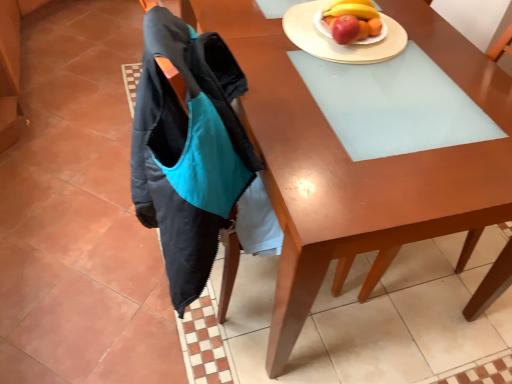
Question: Is wooden plate at upper right, the second plate when ordered from right to left, not within wooden desk at center?

Choices:
 (A) no
 (B) yes

Answer: (A)

Question: Considering the relative sizes of wooden plate at upper right, the second plate when ordered from right to left, and wooden desk at center in the image provided, is wooden plate at upper right, the second plate when ordered from right to left, smaller than wooden desk at center?

Choices:
 (A) yes
 (B) no

Answer: (A)

Question: Is wooden plate at upper right, placed as the 1th plate when sorted from left to right, facing towards wooden desk at center?

Choices:
 (A) yes
 (B) no

Answer: (A)

Question: From the image's perspective, is wooden plate at upper right, placed as the 1th plate when sorted from left to right, beneath wooden desk at center?

Choices:
 (A) no
 (B) yes

Answer: (A)

Question: Is wooden plate at upper right, the second plate when ordered from right to left, taller than wooden desk at center?

Choices:
 (A) no
 (B) yes

Answer: (A)

Question: Is wooden plate at upper right, the second plate when ordered from right to left, positioned in front of wooden desk at center?

Choices:
 (A) no
 (B) yes

Answer: (A)

Question: Does matte wood chair at upper right appear on the right side of wooden desk at center?

Choices:
 (A) yes
 (B) no

Answer: (A)

Question: From the image's perspective, is matte wood chair at upper right on wooden desk at center?

Choices:
 (A) yes
 (B) no

Answer: (B)

Question: Can you confirm if matte wood chair at upper right is taller than wooden desk at center?

Choices:
 (A) yes
 (B) no

Answer: (A)

Question: From a real-world perspective, does matte wood chair at upper right stand above wooden desk at center?

Choices:
 (A) no
 (B) yes

Answer: (B)

Question: Is matte wood chair at upper right oriented towards wooden desk at center?

Choices:
 (A) yes
 (B) no

Answer: (A)

Question: Does matte wood chair at upper right have a lesser height compared to wooden desk at center?

Choices:
 (A) yes
 (B) no

Answer: (B)

Question: Considering the relative positions of wooden desk at center and white glossy plate at upper right, arranged as the second plate when viewed from the left, in the image provided, is wooden desk at center to the left of white glossy plate at upper right, arranged as the second plate when viewed from the left, from the viewer's perspective?

Choices:
 (A) yes
 (B) no

Answer: (A)